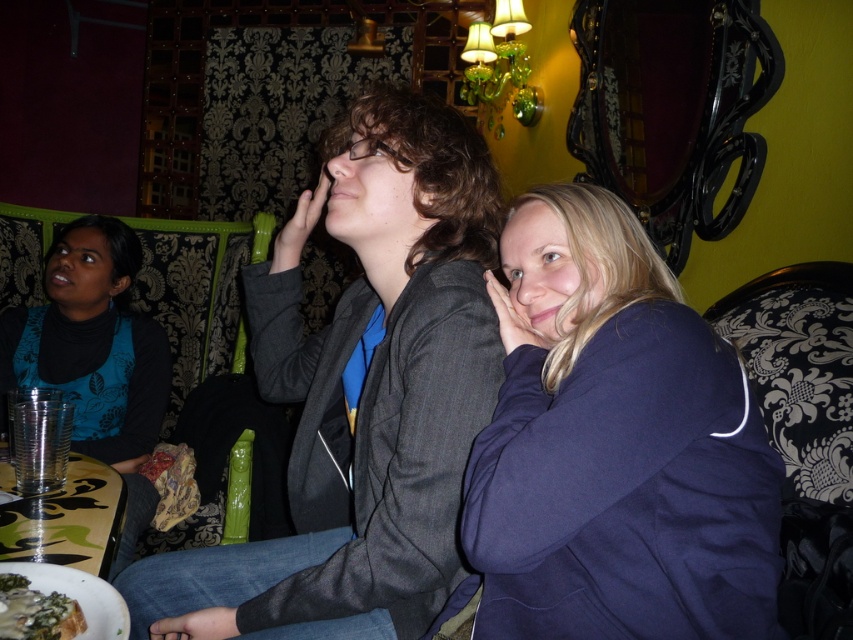
Question: Which point is closer to the camera taking this photo?

Choices:
 (A) (45, 531)
 (B) (24, 636)
 (C) (672, 556)
 (D) (407, 625)

Answer: (B)

Question: Which point is closer to the camera taking this photo?

Choices:
 (A) (59, 538)
 (B) (576, 484)
 (C) (422, 540)
 (D) (25, 616)

Answer: (D)

Question: Is blue patterned top at left to the right of savory green pesto sauce at lower left from the viewer's perspective?

Choices:
 (A) yes
 (B) no

Answer: (B)

Question: Is matte gray blazer at center smaller than dark blue fabric at center?

Choices:
 (A) yes
 (B) no

Answer: (B)

Question: Which object is the farthest from the camouflage-patterned table at lower left?

Choices:
 (A) dark blue fabric at center
 (B) blue patterned top at left
 (C) matte gray blazer at center

Answer: (A)

Question: Does blue patterned top at left appear on the right side of savory green pesto sauce at lower left?

Choices:
 (A) yes
 (B) no

Answer: (B)